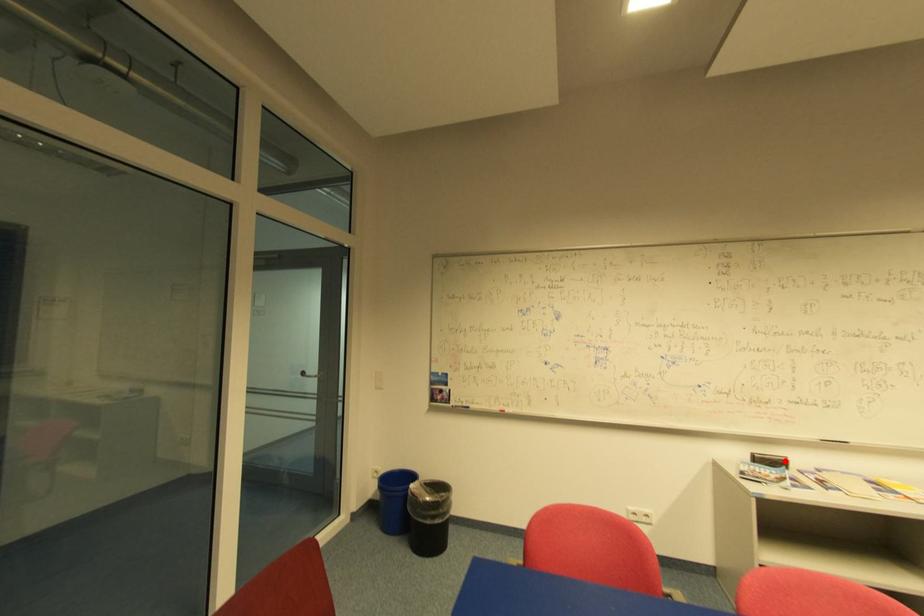
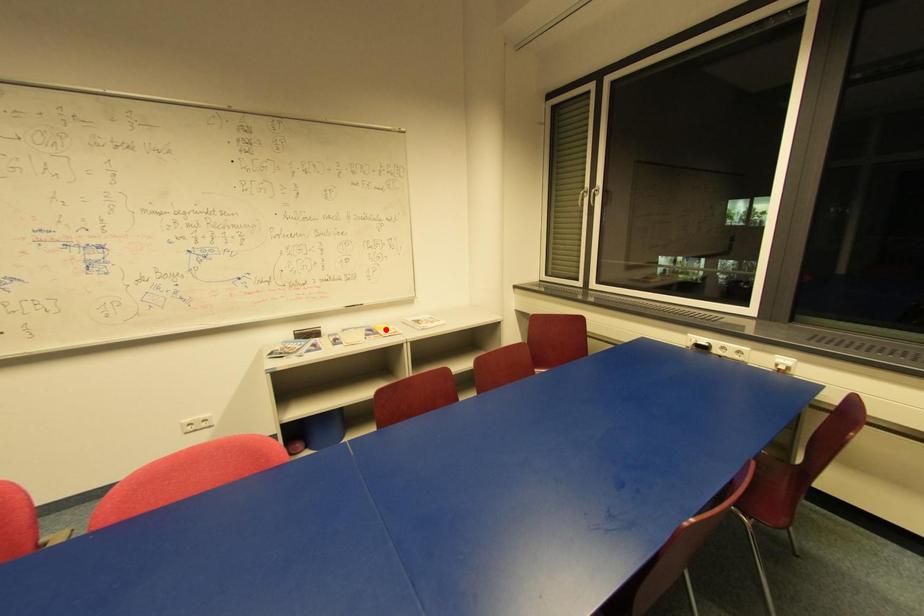
I am providing you with two images of the same scene from different viewpoints. A red point is marked on the first image and another point is marked on the second image. Is the red point in image1 aligned with the point shown in image2?

No